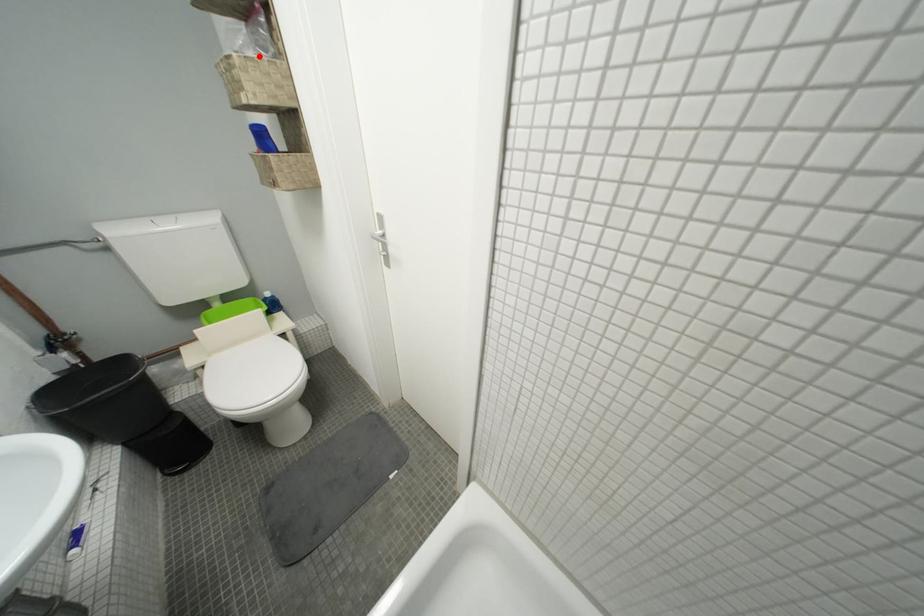
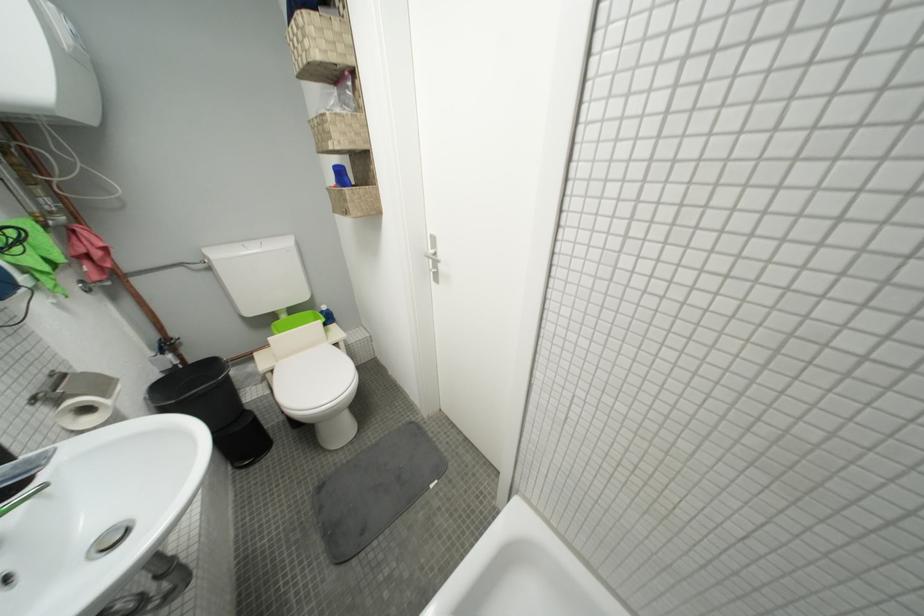
Question: I am providing you with two images of the same scene from different viewpoints. A red point is marked on the first image. Can you still see the location of the red point in image 2?

Choices:
 (A) Yes
 (B) No

Answer: (A)